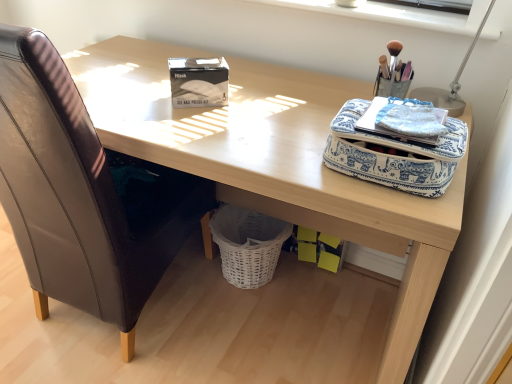
In order to click on free space between blue printed fabric bag at upper right and white matte gel nail polish kit at upper center in this screenshot , I will do `click(260, 124)`.